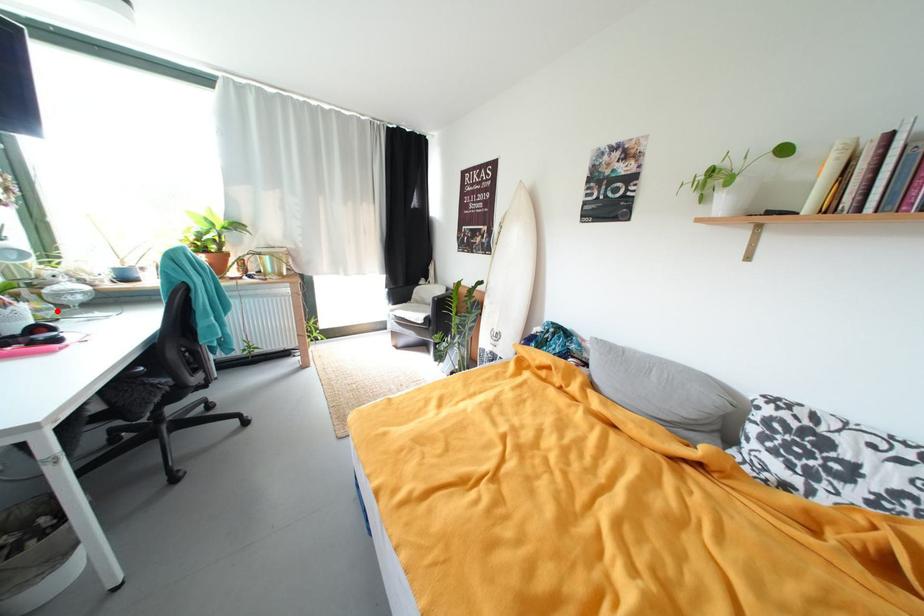
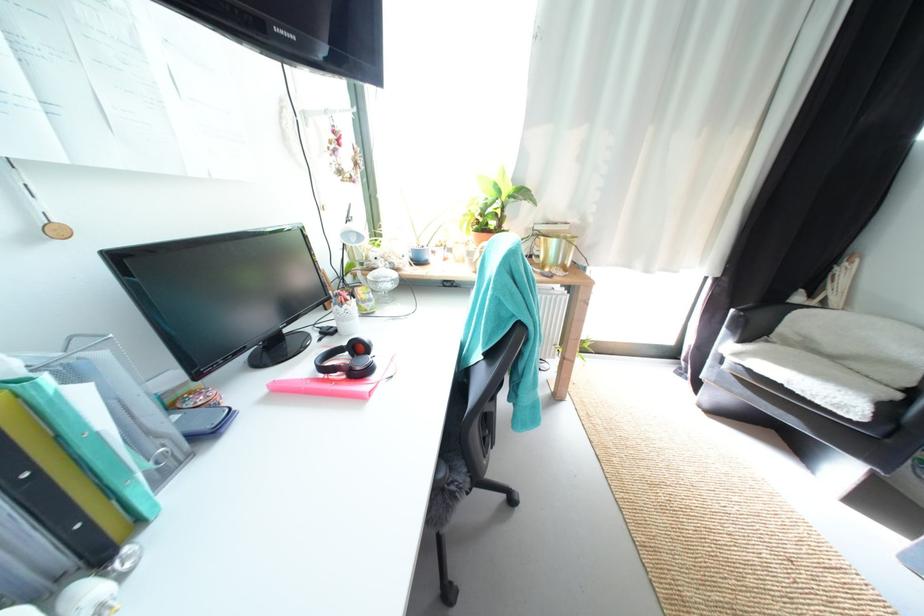
Question: I am providing you with two images of the same scene from different viewpoints. In image1, a red point is highlighted. Considering the same 3D point in image2, which of the following is correct?

Choices:
 (A) It is closer
 (B) It is farther

Answer: (A)